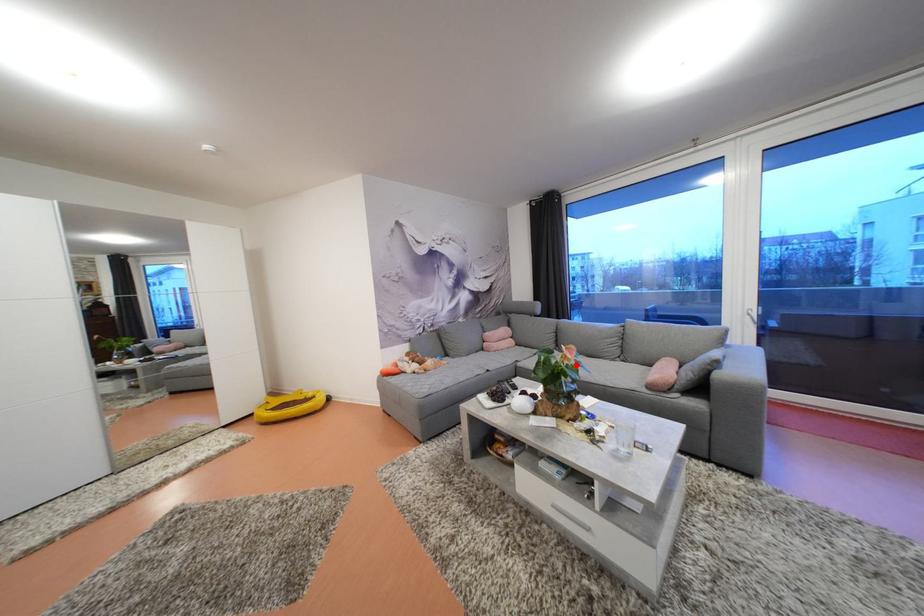
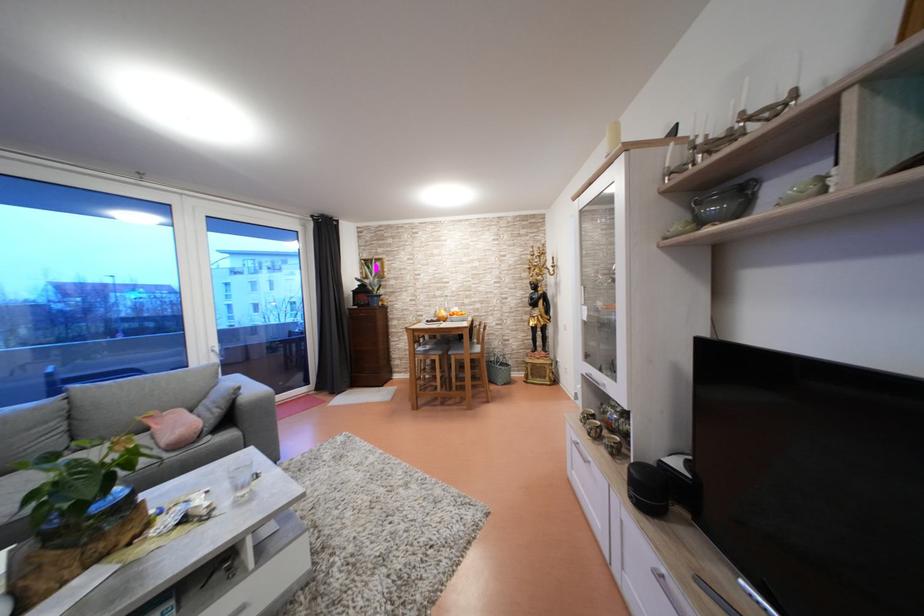
Where in the second image is the point corresponding to the highlighted location from the first image?

(139, 446)